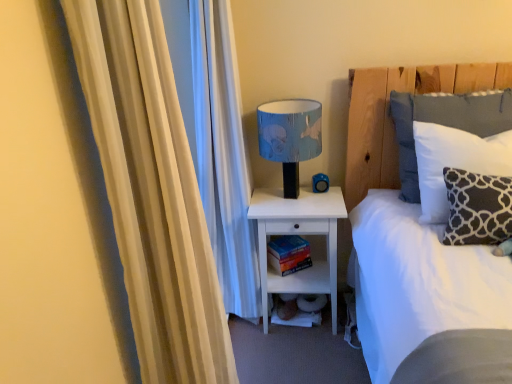
The height and width of the screenshot is (384, 512). In order to click on free point above white matte nightstand at lower center (from a real-world perspective) in this screenshot , I will do `click(303, 201)`.